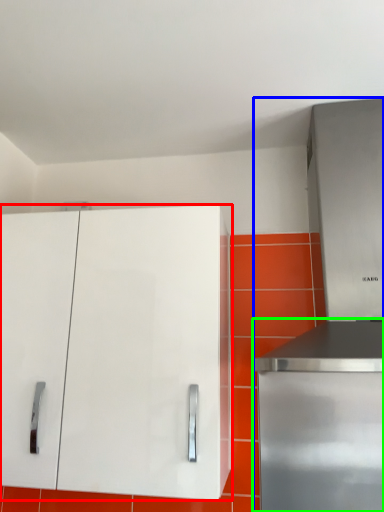
Question: Which is nearer to the cabinetry (highlighted by a red box)? appliance (highlighted by a blue box) or home appliance (highlighted by a green box).

Choices:
 (A) appliance
 (B) home appliance

Answer: (A)